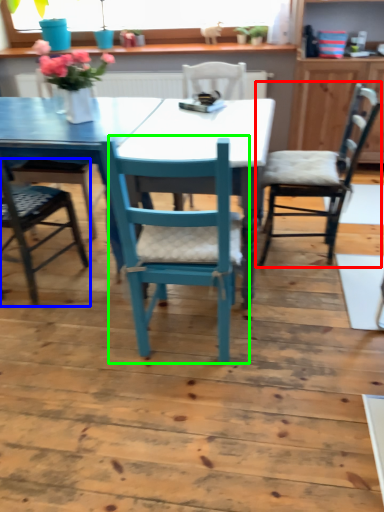
Question: Which object is the farthest from chair (highlighted by a red box)? Choose among these: chair (highlighted by a blue box) or chair (highlighted by a green box).

Choices:
 (A) chair
 (B) chair

Answer: (A)